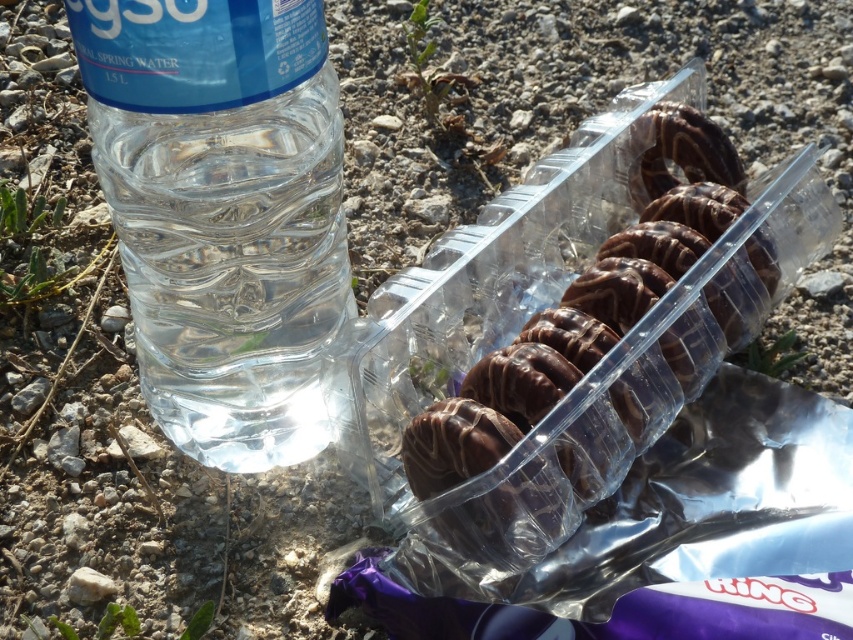
Is point (183, 321) less distant than point (747, 259)?

No, (183, 321) is further to viewer.

Measure the distance between transparent plastic bottle at left and chocolate-coated cookies at center.

The distance of transparent plastic bottle at left from chocolate-coated cookies at center is 4.23 inches.

Measure the distance between transparent plastic bottle at left and camera.

11.05 inches

At what (x,y) coordinates should I click in order to perform the action: click on transparent plastic bottle at left. Please return your answer as a coordinate pair (x, y). This screenshot has height=640, width=853. Looking at the image, I should click on (223, 212).